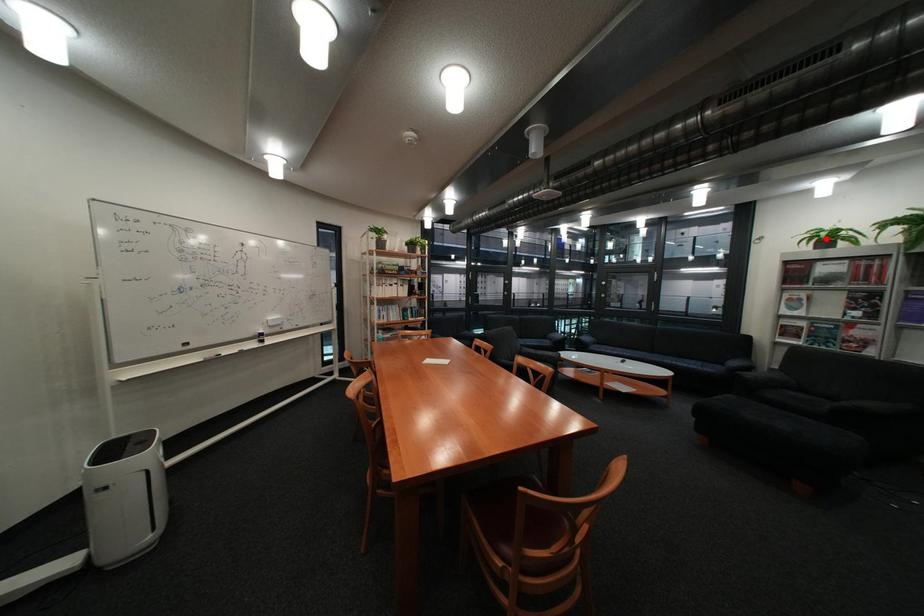
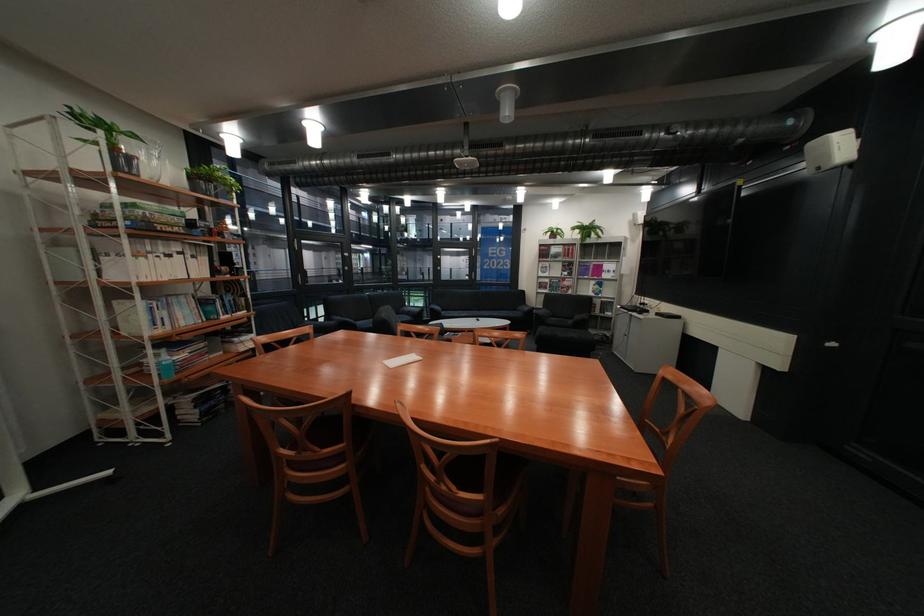
Question: I am providing you with two images of the same scene from different viewpoints. Given a red point in image1, look at the same physical point in image2. Is it:

Choices:
 (A) Closer to the viewpoint
 (B) Farther from the viewpoint

Answer: (A)